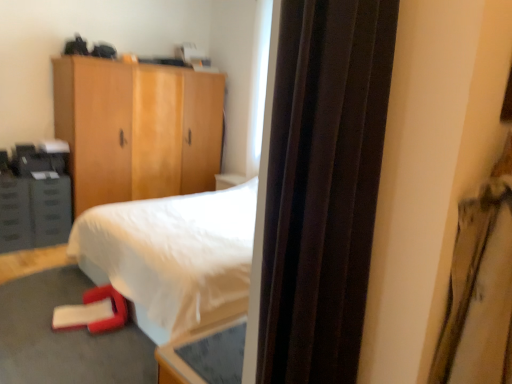
Question: Should I look upward or downward to see wooden cabinet at upper left?

Choices:
 (A) up
 (B) down

Answer: (A)

Question: Is matte gray cabinet at left thinner than metallic gray drawer at left?

Choices:
 (A) no
 (B) yes

Answer: (B)

Question: Does matte gray cabinet at left touch metallic gray drawer at left?

Choices:
 (A) yes
 (B) no

Answer: (A)

Question: Is matte gray cabinet at left turned away from metallic gray drawer at left?

Choices:
 (A) yes
 (B) no

Answer: (B)

Question: Is matte gray cabinet at left to the left of metallic gray drawer at left from the viewer's perspective?

Choices:
 (A) no
 (B) yes

Answer: (A)

Question: Does matte gray cabinet at left have a greater height compared to metallic gray drawer at left?

Choices:
 (A) yes
 (B) no

Answer: (B)

Question: From the image's perspective, is matte gray cabinet at left on metallic gray drawer at left?

Choices:
 (A) no
 (B) yes

Answer: (B)

Question: Is the position of satin brown curtain at right less distant than that of wooden cabinet at upper left?

Choices:
 (A) yes
 (B) no

Answer: (A)

Question: Is satin brown curtain at right smaller than wooden cabinet at upper left?

Choices:
 (A) no
 (B) yes

Answer: (B)

Question: Is there a large distance between satin brown curtain at right and wooden cabinet at upper left?

Choices:
 (A) no
 (B) yes

Answer: (B)

Question: Is satin brown curtain at right oriented towards wooden cabinet at upper left?

Choices:
 (A) no
 (B) yes

Answer: (B)

Question: Does satin brown curtain at right appear on the right side of wooden cabinet at upper left?

Choices:
 (A) yes
 (B) no

Answer: (A)

Question: Is satin brown curtain at right facing away from wooden cabinet at upper left?

Choices:
 (A) yes
 (B) no

Answer: (B)

Question: Does wooden cabinet at upper left have a greater width compared to metallic gray drawer at left?

Choices:
 (A) no
 (B) yes

Answer: (B)